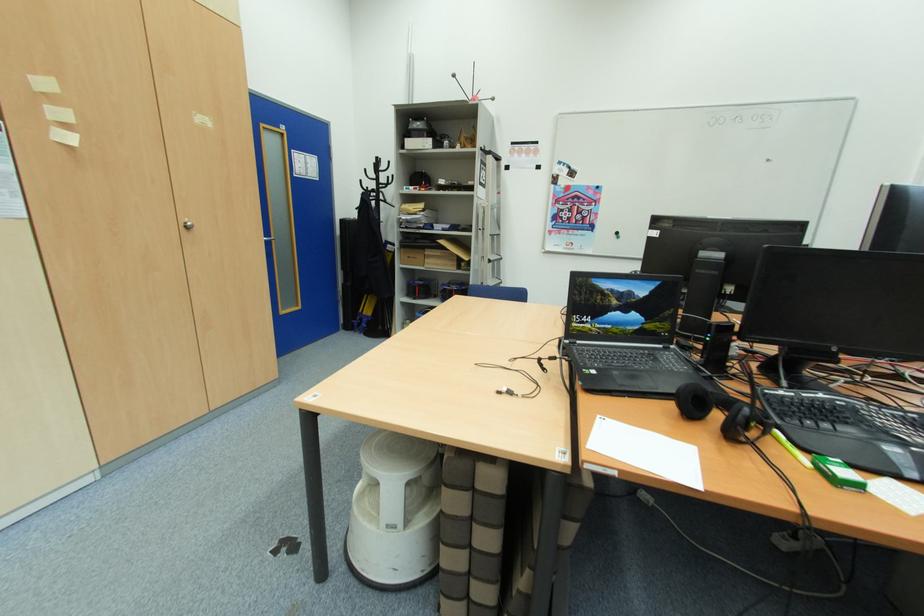
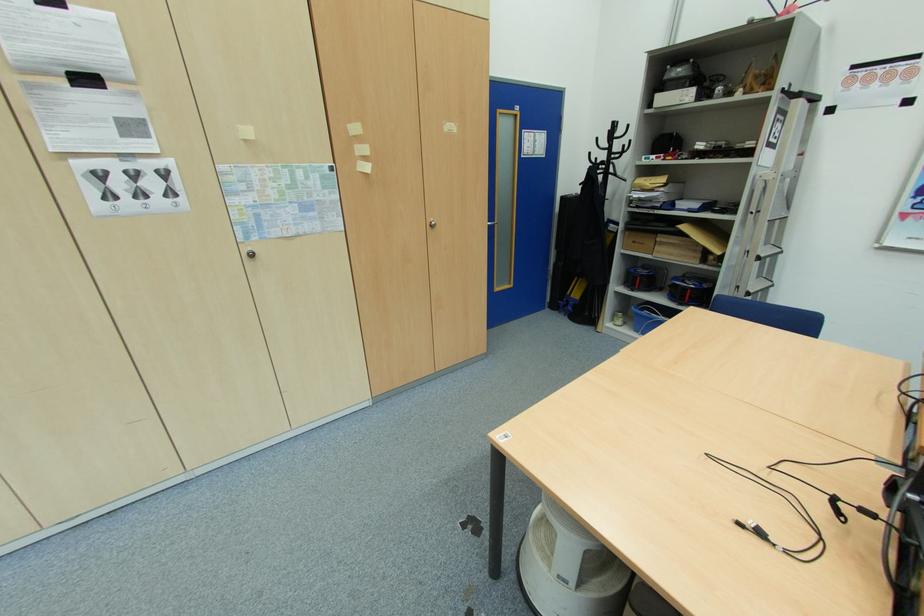
Find the pixel in the second image that matches point (384, 169) in the first image.

(619, 136)